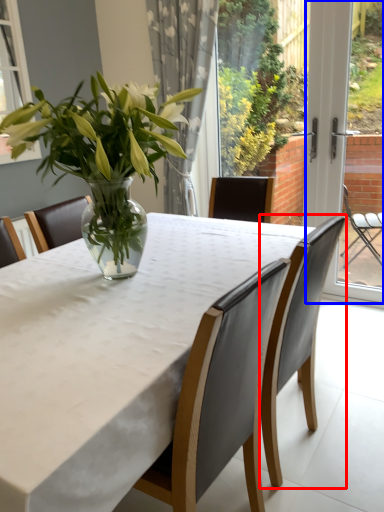
Question: Which object is closer to the camera taking this photo, chair (highlighted by a red box) or screen door (highlighted by a blue box)?

Choices:
 (A) chair
 (B) screen door

Answer: (A)